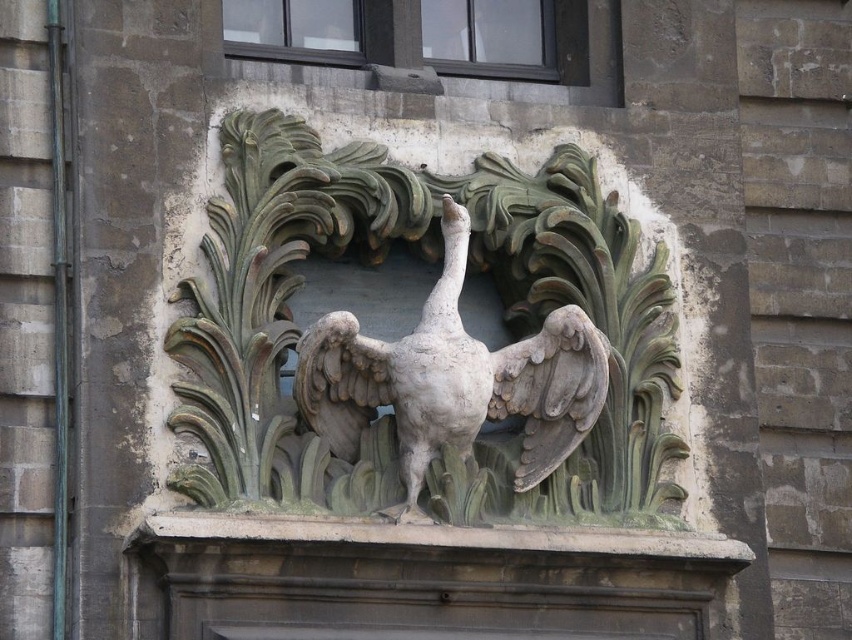
You are standing in front of the architectural relief sculpture described. If the matte stone bird at center is 73.67 meters away from you, would it be possible to see its intricate details clearly without any visual aid?

The matte stone bird at center is 73.67 meters away from the camera, so it would be difficult to see its intricate details clearly without a visual aid due to the significant distance.

From the picture: You are an art conservator examining the architectural relief sculpture. You notice two birds carved into the stone at the center. The first is labeled as the matte stone bird at center and the second as the gray stone bird at center. Which bird is farther to the right?

The matte stone bird at center and gray stone bird at center are 1.07 meters apart from each other, but the description does not specify their left or right positioning. Therefore, it is impossible to determine which bird is farther to the right based on the provided information.